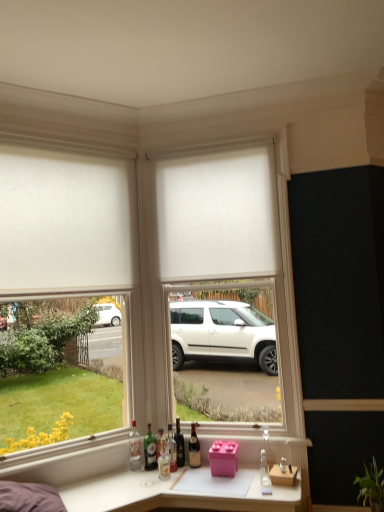
Locate an element on the screen. free space that is to the left of clear glass bottle at center, which is counted as the first bottle, starting from the right is located at coordinates (239, 485).